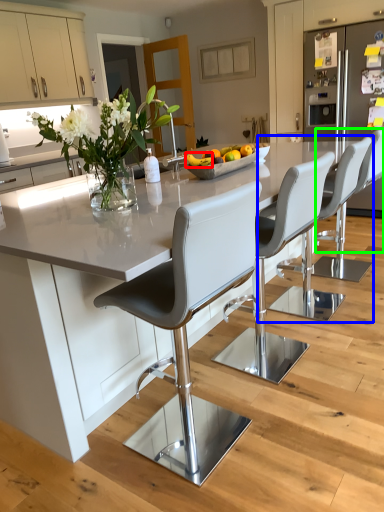
Question: Estimate the real-world distances between objects in this image. Which object is closer to banana (highlighted by a red box), chair (highlighted by a blue box) or chair (highlighted by a green box)?

Choices:
 (A) chair
 (B) chair

Answer: (B)